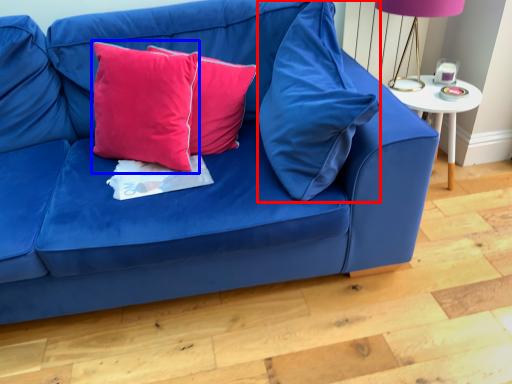
Question: Which object is closer to the camera taking this photo, pillow (highlighted by a red box) or pillow (highlighted by a blue box)?

Choices:
 (A) pillow
 (B) pillow

Answer: (A)